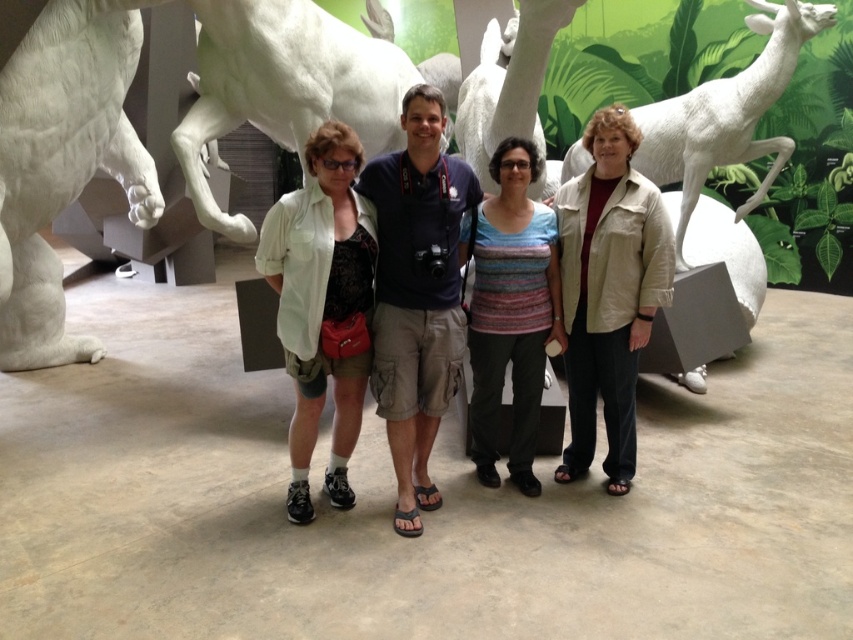
Question: Which point is farther from the camera taking this photo?

Choices:
 (A) (653, 280)
 (B) (694, 177)
 (C) (509, 340)

Answer: (B)

Question: Can you confirm if beige fabric jacket at center is wider than striped knit top at center?

Choices:
 (A) yes
 (B) no

Answer: (B)

Question: Which point is closer to the camera?

Choices:
 (A) white matte deer at right
 (B) striped knit top at center

Answer: (B)

Question: Is white cotton shirt at center smaller than white matte deer at right?

Choices:
 (A) no
 (B) yes

Answer: (B)

Question: Can you confirm if beige fabric jacket at center is positioned above white cotton shirt at center?

Choices:
 (A) yes
 (B) no

Answer: (A)

Question: Which point is farther from the camera taking this photo?

Choices:
 (A) (569, 264)
 (B) (495, 352)
 (C) (749, 202)

Answer: (C)